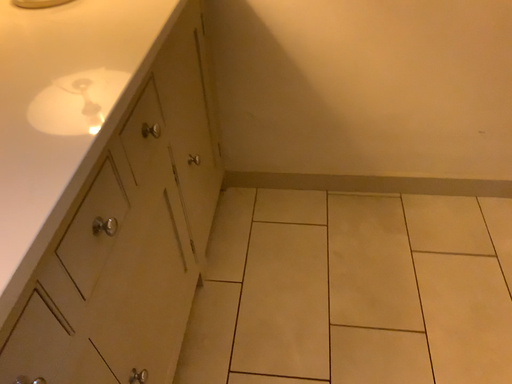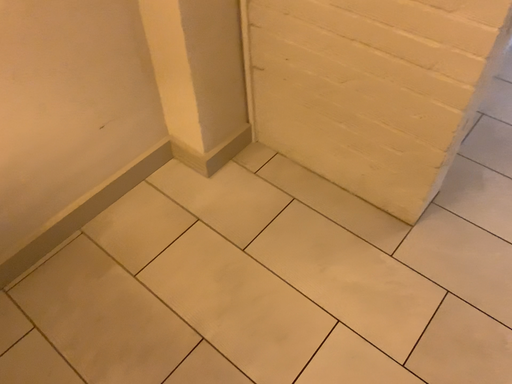
Question: Which way did the camera rotate in the video?

Choices:
 (A) rotated left
 (B) rotated right

Answer: (B)